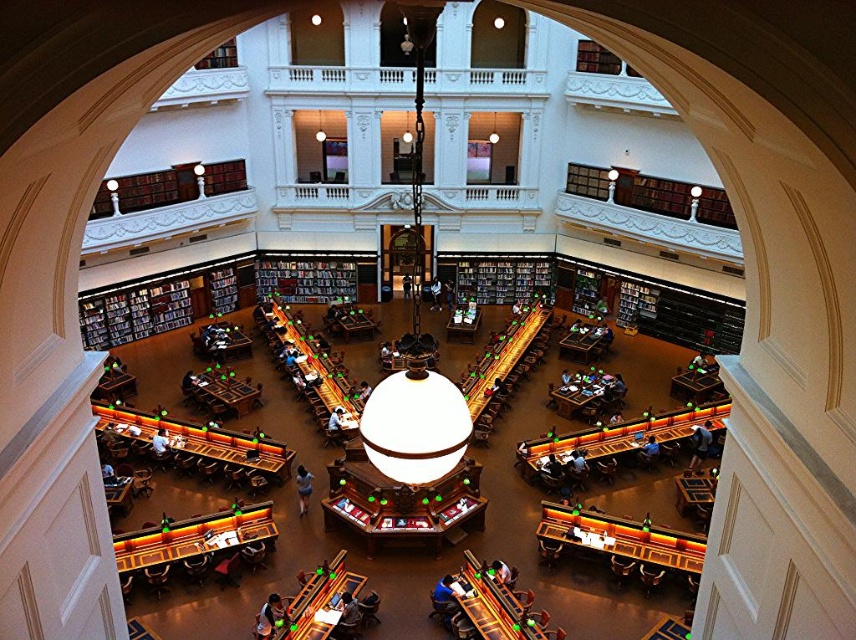
You are an interior designer planning to place a large sculpture in this library. You need to choose between placing it near the wooden bookshelf at left or the dark wood bookshelf at center. Based on their sizes, which location would allow the sculpture to have more space around it?

The wooden bookshelf at left is larger in size than the dark wood bookshelf at center, so placing the sculpture near the wooden bookshelf at left would provide more space around it due to its larger size.

You are standing in the library and want to reach the dark wood bookshelf at center. Which direction should you move from the wooden bookshelf at left to get there?

Since the wooden bookshelf at left is closer to you than the dark wood bookshelf at center, you should move towards the center of the room away from the wooden bookshelf at left to reach the dark wood bookshelf at center.

You are standing at the center of the library and want to place a new bookshelf exactly at the same position as the wooden bookshelf at left. What are the coordinates where you should place it?

The wooden bookshelf at left is located at coordinates point (162, 304), so you should place the new bookshelf at point (162, 304).